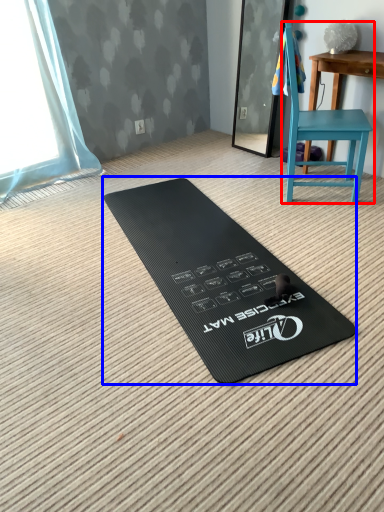
Question: Which object appears farthest to the camera in this image, chair (highlighted by a red box) or yoga mat (highlighted by a blue box)?

Choices:
 (A) chair
 (B) yoga mat

Answer: (A)